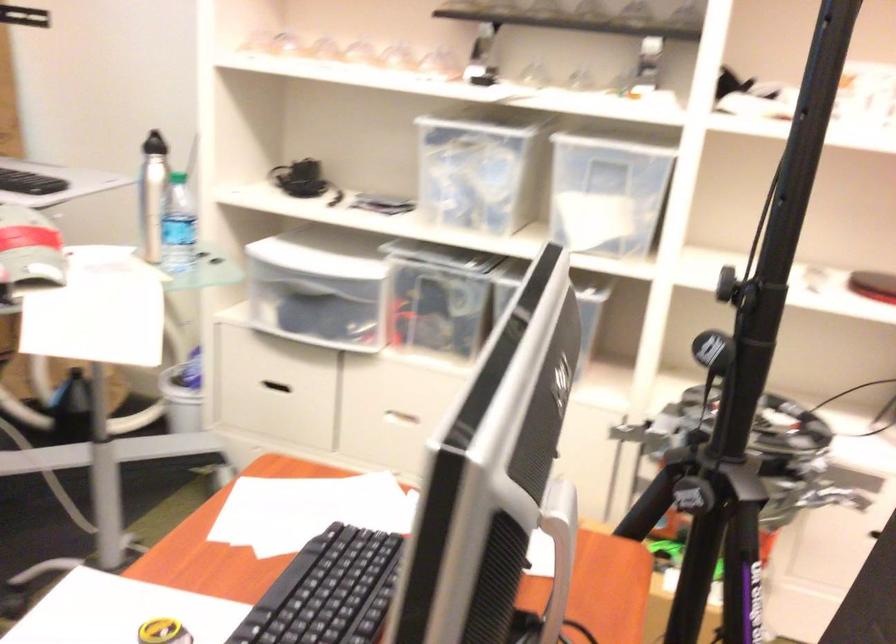
Where is `black mug`? This screenshot has height=644, width=896. black mug is located at coordinates (299, 178).